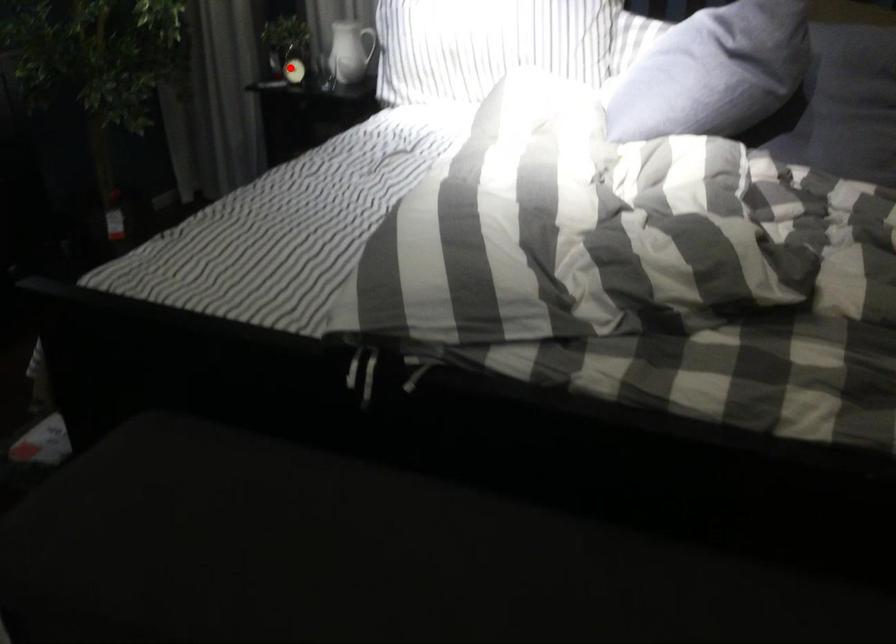
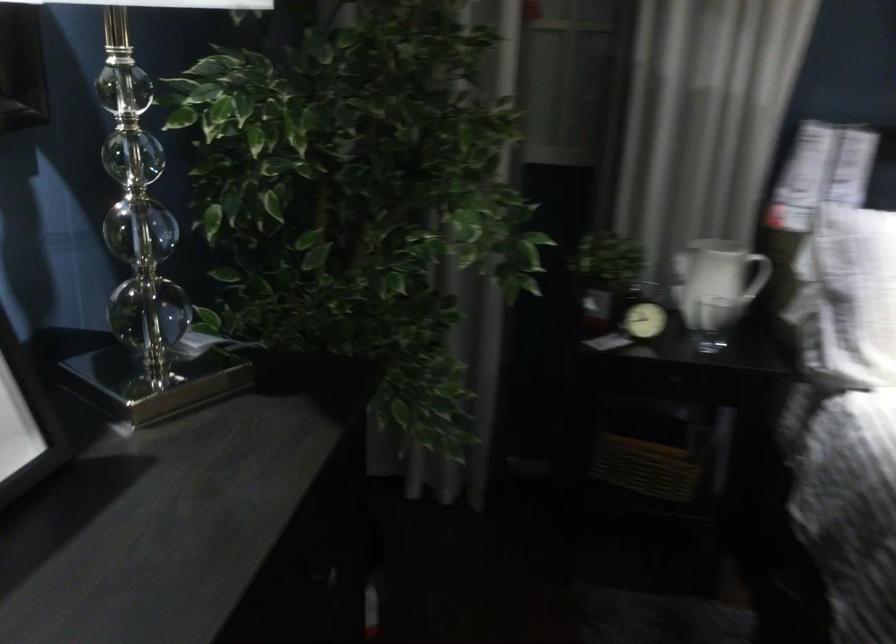
The point at the highlighted location is marked in the first image. Where is the corresponding point in the second image?

(643, 321)